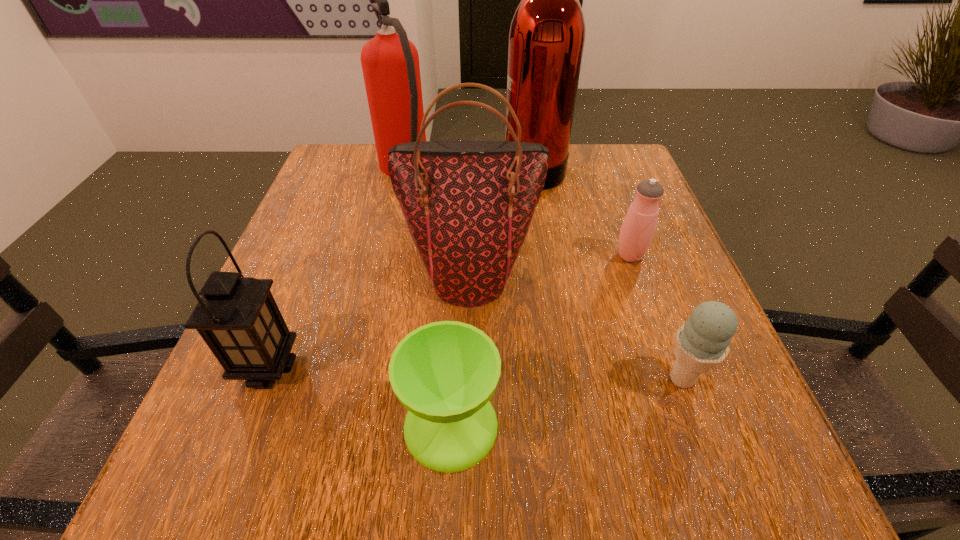
Locate an element on the screen. This screenshot has height=540, width=960. the taller fire extinguisher is located at coordinates (547, 34).

Where is `the tallest object`? The height and width of the screenshot is (540, 960). the tallest object is located at coordinates (547, 34).

Locate an element on the screen. This screenshot has width=960, height=540. the shorter fire extinguisher is located at coordinates (390, 62).

You are a GUI agent. You are given a task and a screenshot of the screen. Output one action in this format:
    pyautogui.click(x=<x>, y=<y>)
    Task: Click on the handbag
    
    Given the screenshot: What is the action you would take?
    pyautogui.click(x=468, y=205)

Find the location of a particular element. The height and width of the screenshot is (540, 960). lantern is located at coordinates (237, 317).

Find the location of a particular element. This screenshot has height=540, width=960. the leftmost object is located at coordinates coord(237,317).

Find the location of a particular element. The width and height of the screenshot is (960, 540). thermos bottle is located at coordinates (639, 225).

Where is `ice cream`? This screenshot has height=540, width=960. ice cream is located at coordinates (701, 343).

You are a GUI agent. You are given a task and a screenshot of the screen. Output one action in this format:
    pyautogui.click(x=<x>, y=<y>)
    Task: Click on the wineglass
    
    Given the screenshot: What is the action you would take?
    pyautogui.click(x=444, y=373)

At what (x,y) coordinates should I click in order to perform the action: click on blank area located 0.270m on the front-facing side of the right fire extinguisher. Please return your answer as a coordinate pair (x, y). This screenshot has height=540, width=960. Looking at the image, I should click on (x=396, y=166).